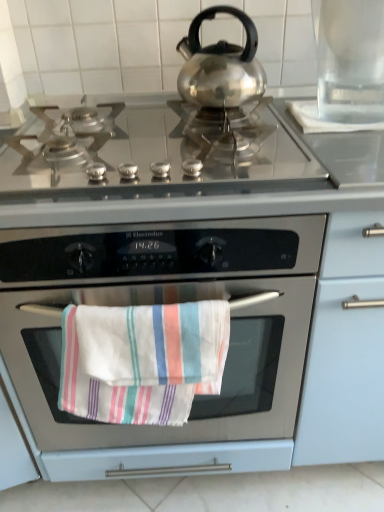
Question: Does white striped towel at center have a larger size compared to stainless steel cooktop at center?

Choices:
 (A) yes
 (B) no

Answer: (B)

Question: From a real-world perspective, is white striped towel at center below stainless steel cooktop at center?

Choices:
 (A) yes
 (B) no

Answer: (A)

Question: Is white striped towel at center further to camera compared to stainless steel cooktop at center?

Choices:
 (A) no
 (B) yes

Answer: (B)

Question: Would you say white striped towel at center is a long distance from stainless steel cooktop at center?

Choices:
 (A) no
 (B) yes

Answer: (A)

Question: Is white striped towel at center next to stainless steel cooktop at center and touching it?

Choices:
 (A) no
 (B) yes

Answer: (A)

Question: Is white striped towel at center to the left of stainless steel cooktop at center from the viewer's perspective?

Choices:
 (A) yes
 (B) no

Answer: (A)

Question: From the image's perspective, is stainless steel cooktop at center under transparent glass pitcher at upper right?

Choices:
 (A) yes
 (B) no

Answer: (A)

Question: Is stainless steel cooktop at center positioned before transparent glass pitcher at upper right?

Choices:
 (A) no
 (B) yes

Answer: (B)

Question: From a real-world perspective, is stainless steel cooktop at center located beneath transparent glass pitcher at upper right?

Choices:
 (A) yes
 (B) no

Answer: (A)

Question: Is stainless steel cooktop at center oriented away from transparent glass pitcher at upper right?

Choices:
 (A) yes
 (B) no

Answer: (B)

Question: From the image's perspective, is stainless steel cooktop at center located above transparent glass pitcher at upper right?

Choices:
 (A) yes
 (B) no

Answer: (B)

Question: Is stainless steel cooktop at center to the left of transparent glass pitcher at upper right from the viewer's perspective?

Choices:
 (A) no
 (B) yes

Answer: (B)

Question: From a real-world perspective, is transparent glass pitcher at upper right positioned over stainless steel oven at center based on gravity?

Choices:
 (A) no
 (B) yes

Answer: (B)